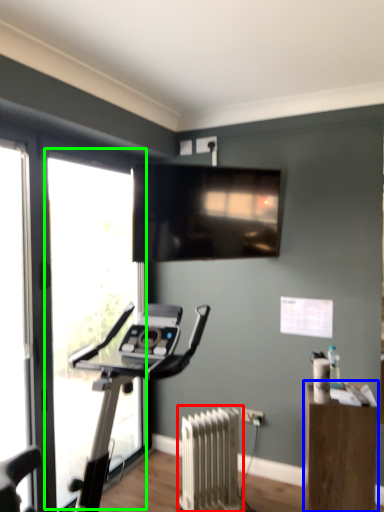
Question: Which object is positioned closest to radiator (highlighted by a red box)? Select from furniture (highlighted by a blue box) and window (highlighted by a green box).

Choices:
 (A) furniture
 (B) window

Answer: (A)